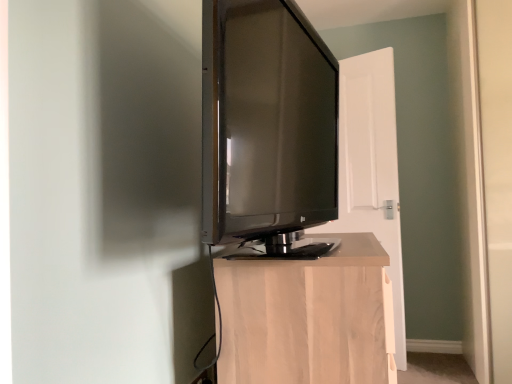
Question: Is light wood cabinet at center inside or outside of white wood door at center?

Choices:
 (A) inside
 (B) outside

Answer: (B)

Question: From their relative heights in the image, would you say light wood cabinet at center is taller or shorter than white wood door at center?

Choices:
 (A) short
 (B) tall

Answer: (A)

Question: Estimate the real-world distances between objects in this image. Which object is farther from the white wood door at center?

Choices:
 (A) matte black tv at center
 (B) light wood cabinet at center

Answer: (B)

Question: Which of these objects is positioned closest to the light wood cabinet at center?

Choices:
 (A) white wood door at center
 (B) matte black tv at center

Answer: (B)